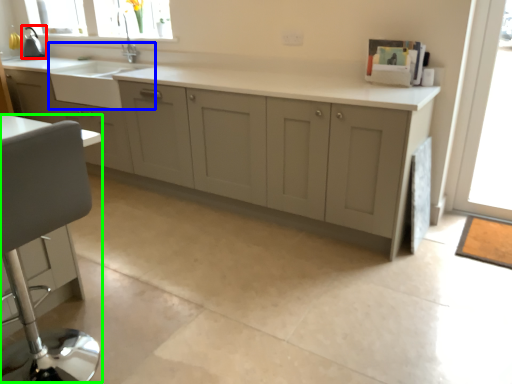
Question: Estimate the real-world distances between objects in this image. Which object is closer to appliance (highlighted by a red box), sink (highlighted by a blue box) or swivel chair (highlighted by a green box)?

Choices:
 (A) sink
 (B) swivel chair

Answer: (A)